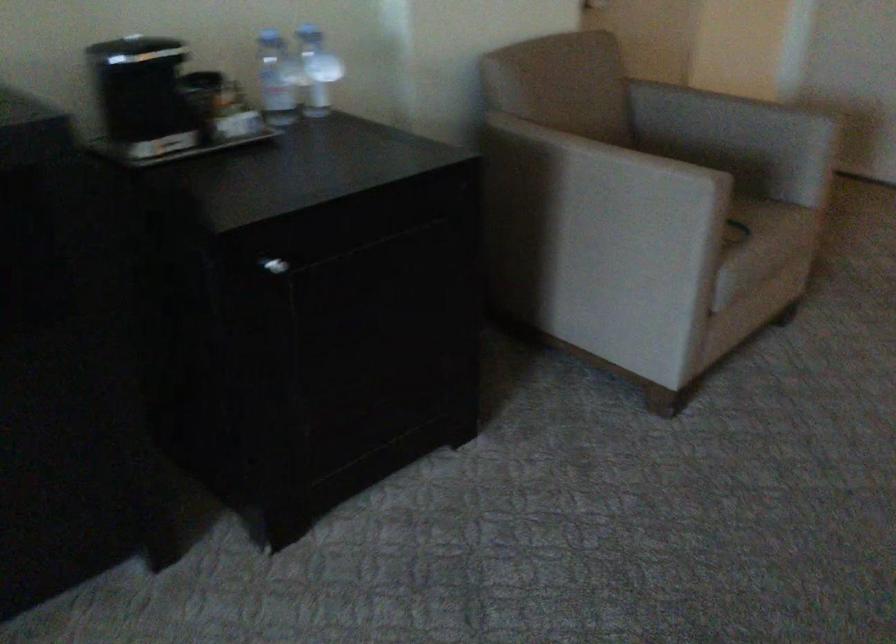
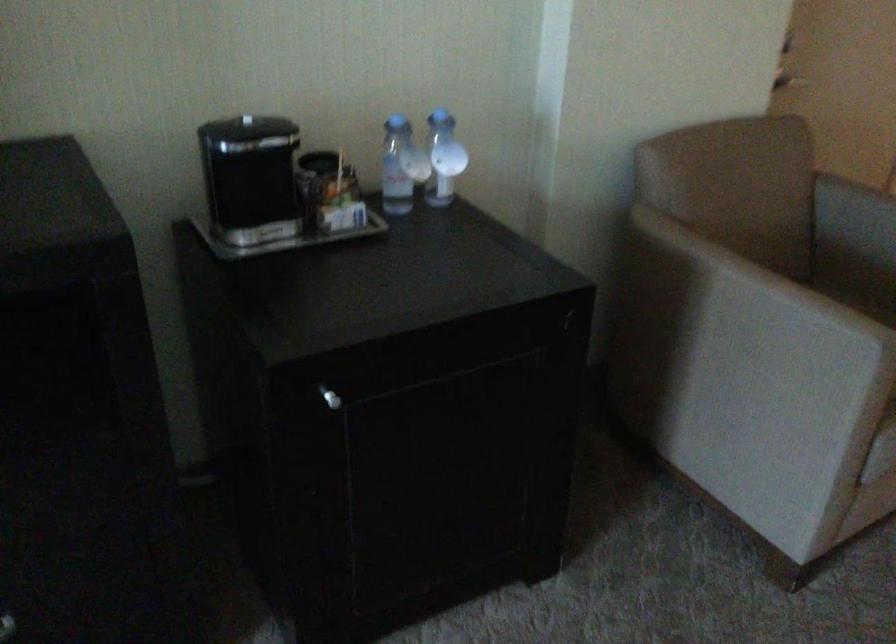
The point at (321, 69) is marked in the first image. Where is the corresponding point in the second image?

(443, 158)